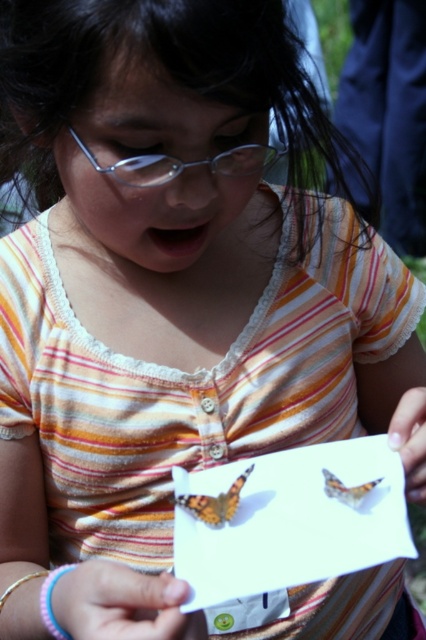
The girl is holding a white paper with two butterflies. Which butterfly is positioned lower on the paper, the orange and black butterfly at center or the orange patterned butterfly at center?

The orange and black butterfly at center is positioned below the orange patterned butterfly at center, so it is lower on the paper.

The girl is holding a white paper with two butterflies. She wants to touch the butterflies without moving her glasses. Which butterfly is easier to reach, the clear plastic glasses at center or the orange patterned butterfly at center?

The clear plastic glasses at center is closer to the viewer than the orange patterned butterfly at center, so the clear plastic glasses at center is easier to reach.

The girl is holding a white paper with both the clear plastic glasses at center and the orange and black butterfly at center on it. Which object takes up more space on the paper?

The clear plastic glasses at center is bigger than the orange and black butterfly at center, so it takes up more space on the paper.